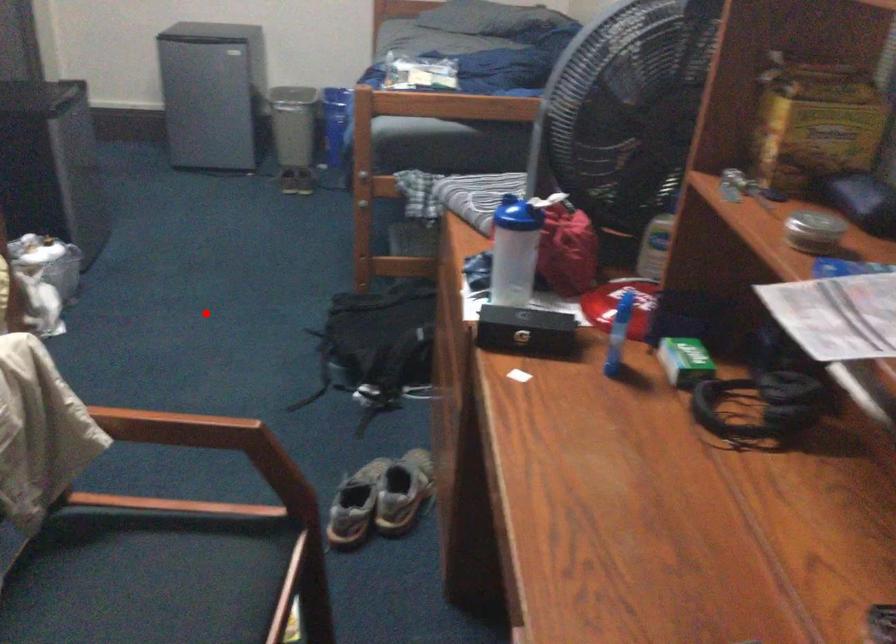
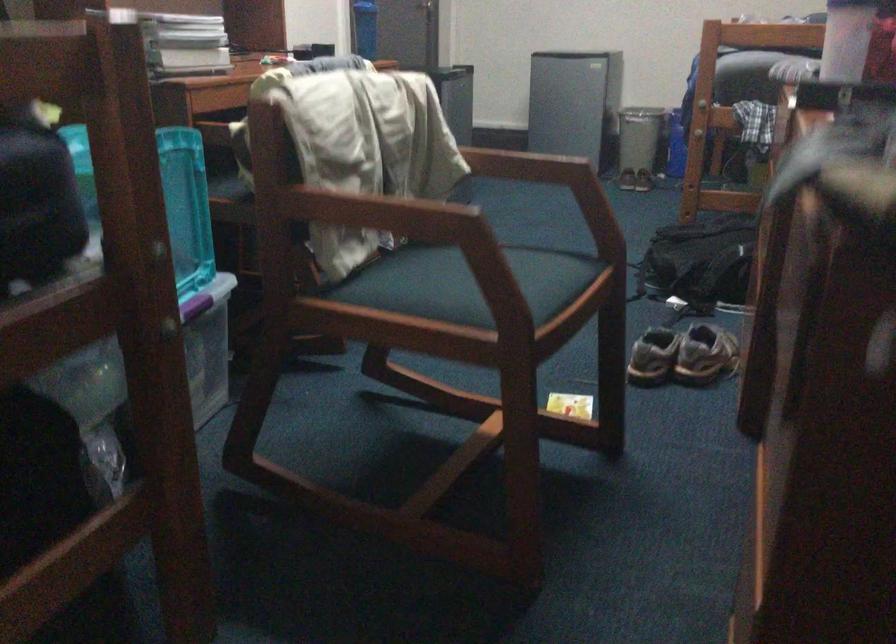
The point at the highlighted location is marked in the first image. Where is the corresponding point in the second image?

(543, 242)